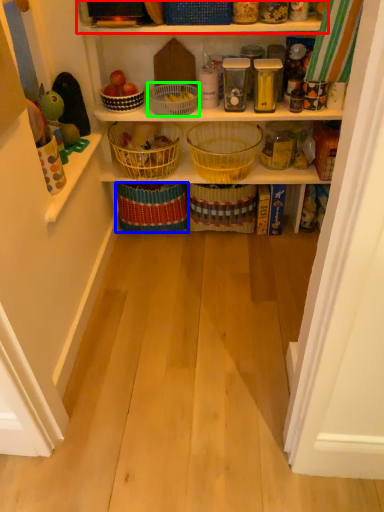
Question: Estimate the real-world distances between objects in this image. Which object is farther from shelf (highlighted by a red box), basket (highlighted by a blue box) or basket (highlighted by a green box)?

Choices:
 (A) basket
 (B) basket

Answer: (A)